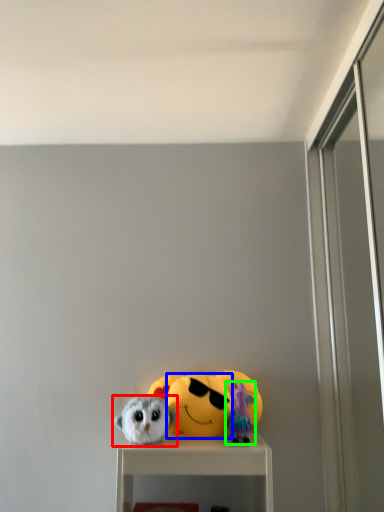
Question: Which object is positioned closest to toy (highlighted by a red box)? Select from face (highlighted by a blue box) and toy (highlighted by a green box).

Choices:
 (A) face
 (B) toy

Answer: (A)